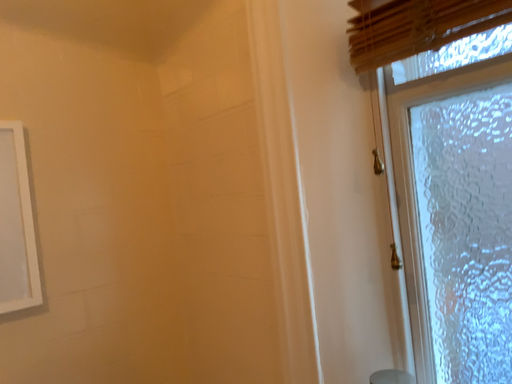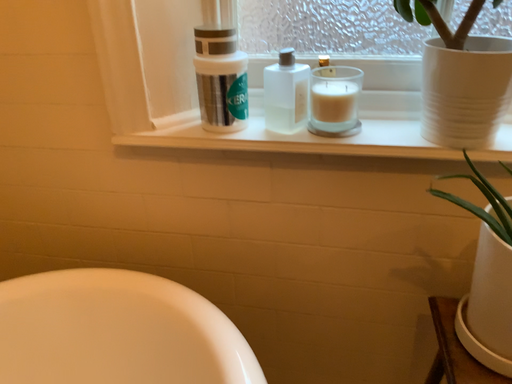
Question: How did the camera likely rotate when shooting the video?

Choices:
 (A) rotated upward
 (B) rotated downward

Answer: (B)